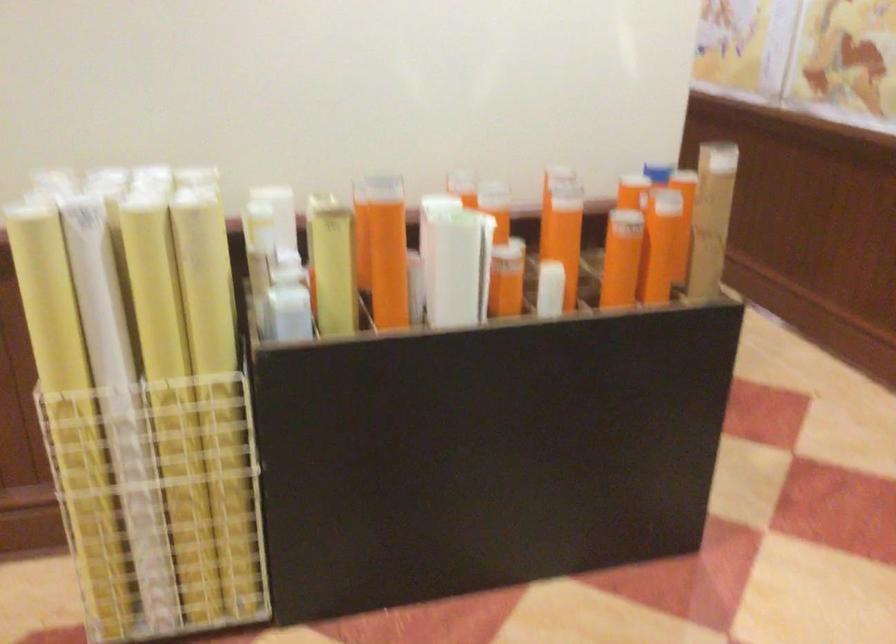
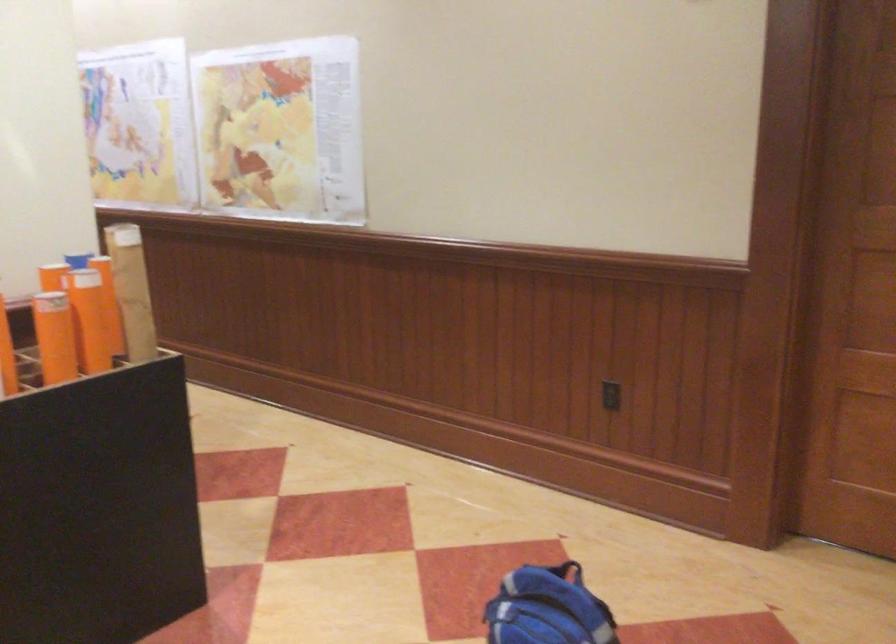
Where in the second image is the point corresponding to (686,216) from the first image?

(132, 290)